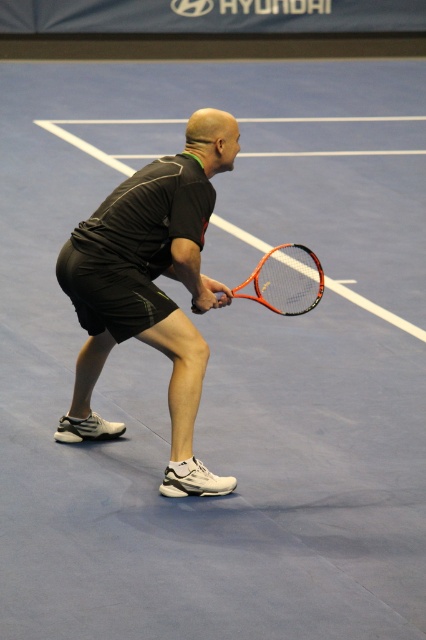
In the scene shown: You are a tennis coach observing a player holding two rackets, the black matte tennis racket at center and the orange carbon fiber tennis racket at center. Which racket should the player choose if they need a larger one for better control?

The player should choose the black matte tennis racket at center because it is larger in size than the orange carbon fiber tennis racket at center, providing better control.

You are a tennis coach observing a player holding two rackets, the black matte tennis racket at center and the orange carbon fiber tennis racket at center. Which racket is taller?

The black matte tennis racket at center is taller than the orange carbon fiber tennis racket at center.